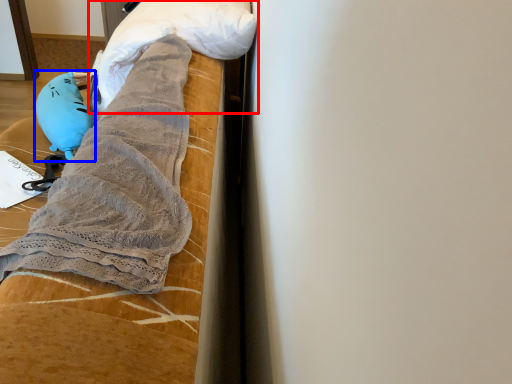
Question: Among these objects, which one is farthest to the camera, wrap (highlighted by a red box) or toy (highlighted by a blue box)?

Choices:
 (A) wrap
 (B) toy

Answer: (B)